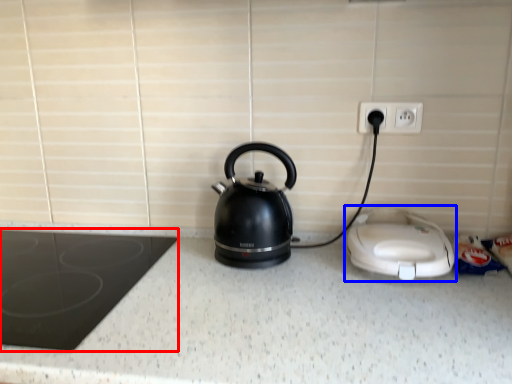
Question: Which object is further to the camera taking this photo, home appliance (highlighted by a red box) or home appliance (highlighted by a blue box)?

Choices:
 (A) home appliance
 (B) home appliance

Answer: (B)